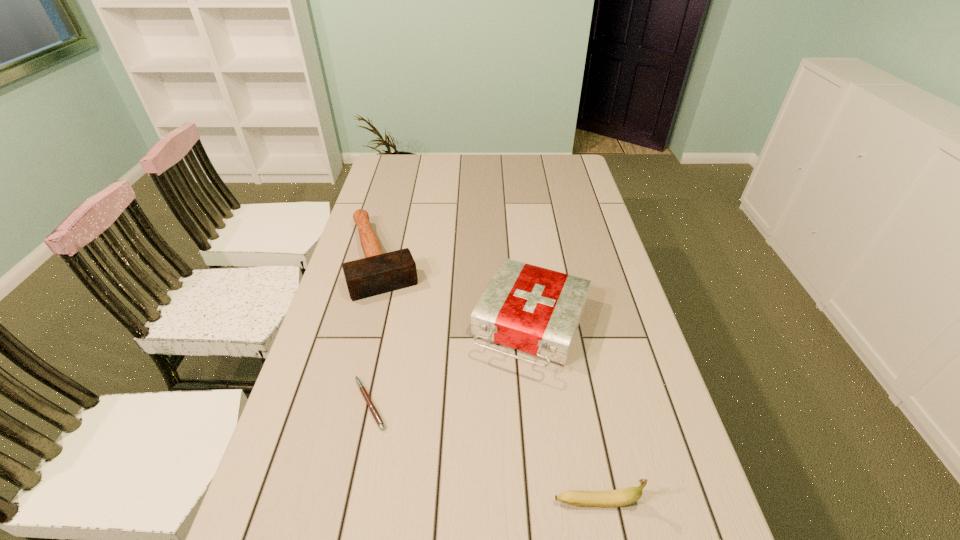
Where is `the shortest object`? the shortest object is located at coordinates (372, 408).

Where is `banana`? banana is located at coordinates point(611,498).

Locate an element on the screen. This screenshot has width=960, height=540. mallet is located at coordinates (377, 273).

The width and height of the screenshot is (960, 540). Identify the location of the first-aid kit. (536, 310).

At what (x,y) coordinates should I click in order to perform the action: click on free region located 0.050m at the nib of the pen. Please return your answer as a coordinate pair (x, y). Image resolution: width=960 pixels, height=540 pixels. Looking at the image, I should click on (329, 403).

Where is `free spot located 0.120m at the nib of the pen`? The image size is (960, 540). free spot located 0.120m at the nib of the pen is located at coordinates (300, 403).

Where is `free region located at the stem of the banana`? The height and width of the screenshot is (540, 960). free region located at the stem of the banana is located at coordinates [x=677, y=501].

This screenshot has width=960, height=540. Identify the location of blank area located 0.360m on the striking face of the mallet. (422, 395).

The width and height of the screenshot is (960, 540). In order to click on free space located on the striking face of the mallet in this screenshot , I will do `click(417, 379)`.

The width and height of the screenshot is (960, 540). In order to click on blank space located 0.100m on the striking face of the mallet in this screenshot , I will do `click(396, 321)`.